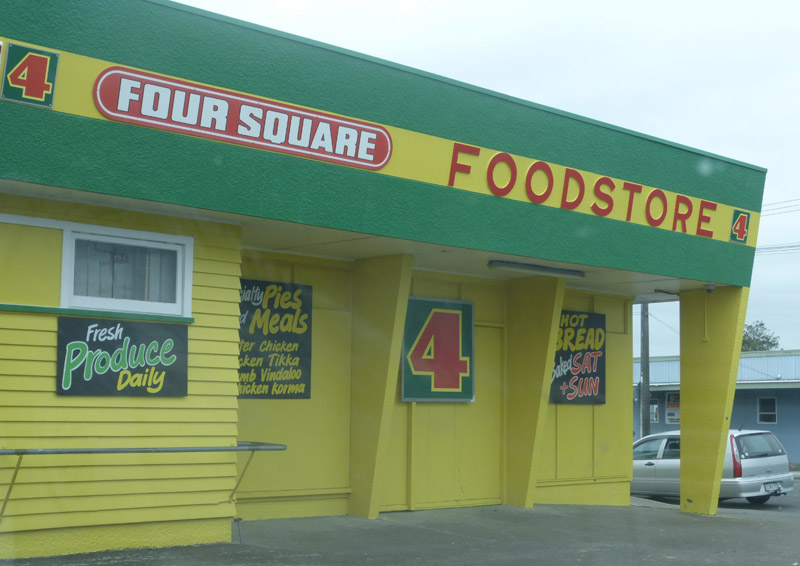
Image resolution: width=800 pixels, height=566 pixels. Find the location of `window`. window is located at coordinates (150, 278).